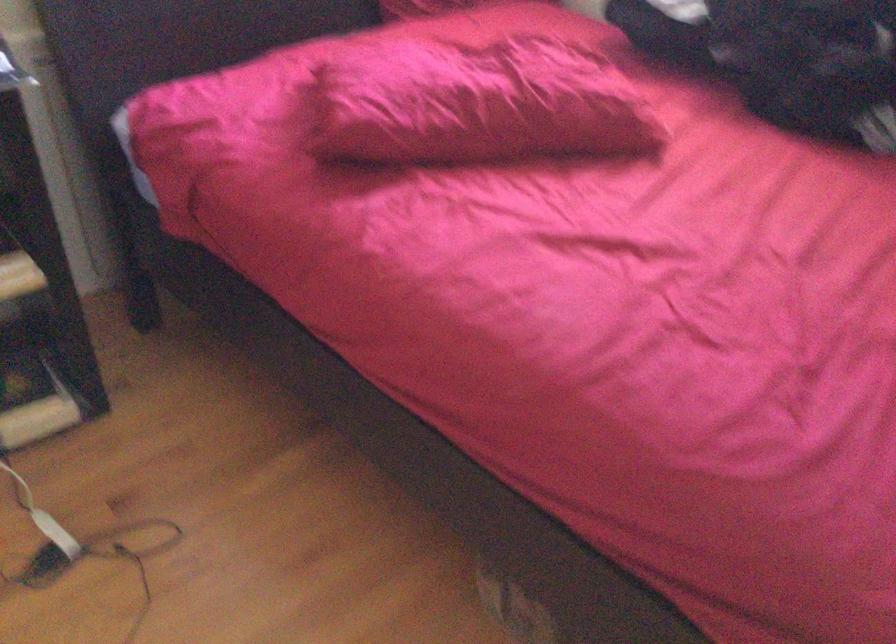
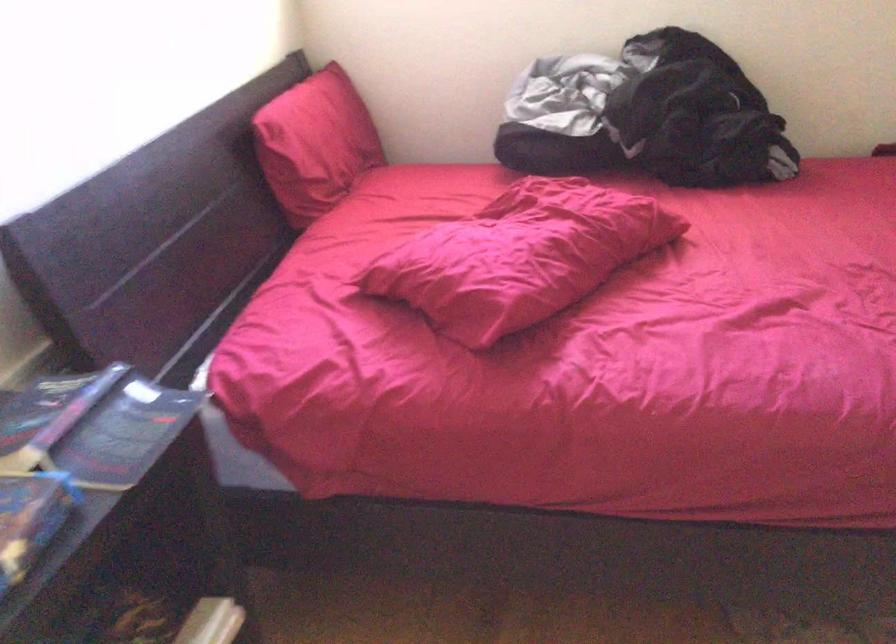
Question: Based on the continuous images, in which direction is the camera rotating? Reply with the corresponding letter.

Choices:
 (A) Left
 (B) Right
 (C) Up
 (D) Down

Answer: (B)